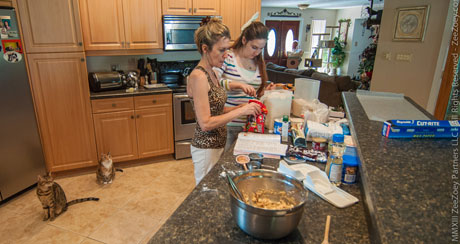
Where is `refrigerator`? refrigerator is located at coordinates (11, 138).